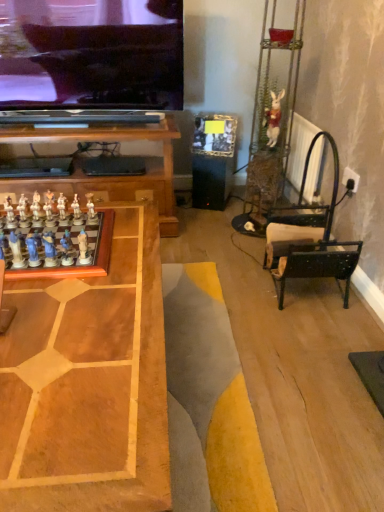
Question: Is point click(61, 246) closer or farther from the camera than point click(9, 218)?

Choices:
 (A) farther
 (B) closer

Answer: (B)

Question: Is matte blue chess piece at left, which is counted as the fourth toy, starting from the right, spatially inside white glossy chess piece at left, which ranks as the 6th toy in back-to-front order, or outside of it?

Choices:
 (A) outside
 (B) inside

Answer: (A)

Question: Which is farther from the white glossy chess piece at center-left, marked as the seventh toy in a back-to-front arrangement?

Choices:
 (A) white glossy chess piece at left, placed as the seventh toy when sorted from front to back
 (B) white glossy chess pieces at left, the 7th toy when ordered from left to right
 (C) wooden chessboard at center
 (D) white glossy chess piece at left, which is the first toy from left to right
 (E) matte blue chess pieces at left, placed as the 9th toy when sorted from right to left

Answer: (C)

Question: Which of these objects is positioned closest to the white fabric rabbit at upper right, which is counted as the first toy, starting from the right?

Choices:
 (A) white glossy chess piece at center-left, which is the fifth toy from front to back
 (B) wooden chessboard at center
 (C) white glossy chess set at lower left
 (D) white glossy chess piece at center-left, marked as the 10th toy in a front-to-back arrangement
 (E) white glossy chess pieces at left, arranged as the 5th toy when viewed from the right

Answer: (D)